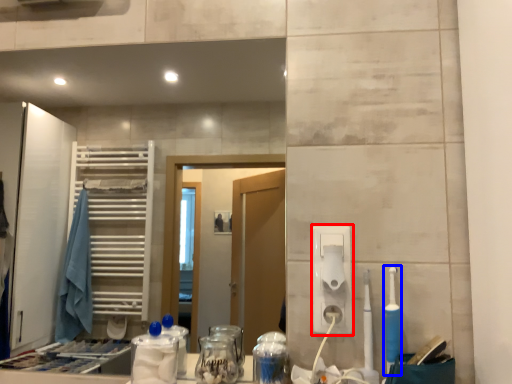
Question: Which object is further to the camera taking this photo, hand dryer (highlighted by a red box) or toothbrush (highlighted by a blue box)?

Choices:
 (A) hand dryer
 (B) toothbrush

Answer: (A)